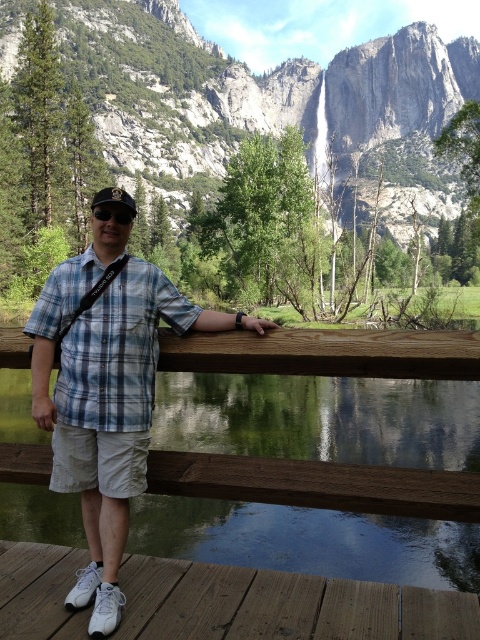
Does brown wooden deck at lower center have a smaller size compared to blue plaid shirt at center?

Indeed, brown wooden deck at lower center has a smaller size compared to blue plaid shirt at center.

Does point (328, 616) come in front of point (108, 396)?

That is True.

Who is more distant from viewer, (x=146, y=566) or (x=179, y=324)?

Point (x=179, y=324)

In order to click on brown wooden deck at lower center in this screenshot , I will do `click(282, 605)`.

Which of these two, granite cliff face at upper center or blue plaid shirt at center, stands shorter?

blue plaid shirt at center is shorter.

Which is in front, point (451, 60) or point (117, 349)?

Point (117, 349)

Who is more forward, (180, 68) or (142, 340)?

Point (142, 340) is in front.

Where is `granite cliff face at upper center`? Image resolution: width=480 pixels, height=640 pixels. granite cliff face at upper center is located at coordinates (261, 93).

Who is positioned more to the left, brown wooden deck at lower center or black matte goggles at center?

black matte goggles at center

Between brown wooden deck at lower center and black matte goggles at center, which one is positioned lower?

Positioned lower is brown wooden deck at lower center.

Where is `brown wooden deck at lower center`? brown wooden deck at lower center is located at coordinates (282, 605).

The height and width of the screenshot is (640, 480). I want to click on brown wooden deck at lower center, so click(282, 605).